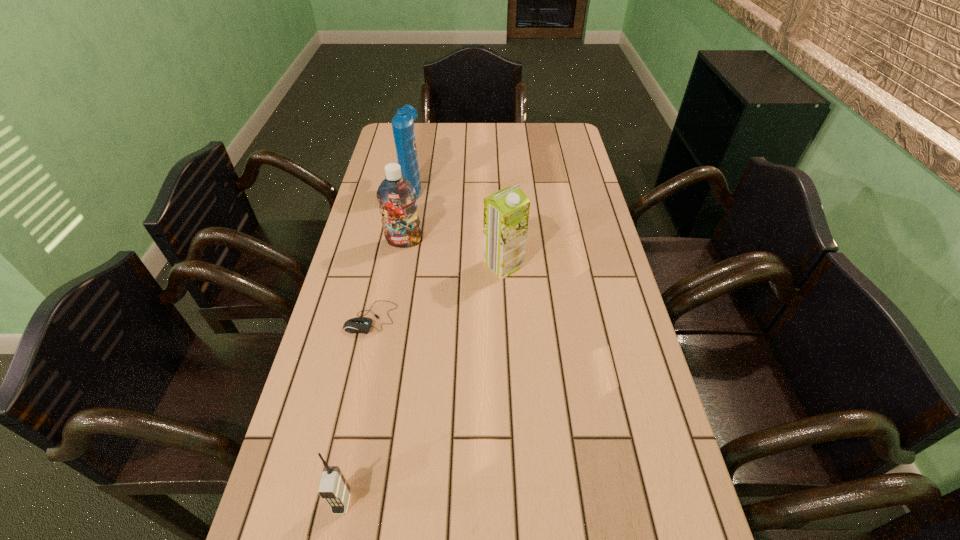
Find the location of a particular element. This screenshot has height=540, width=960. free space between the third farthest object and the farther shampoo is located at coordinates (458, 226).

The height and width of the screenshot is (540, 960). I want to click on free spot between the computer mouse and the farthest object, so click(x=392, y=252).

Locate an element on the screen. Image resolution: width=960 pixels, height=540 pixels. vacant area that lies between the third farthest object and the second shortest object is located at coordinates (422, 383).

The image size is (960, 540). I want to click on vacant space in between the cellular telephone and the farther shampoo, so click(x=377, y=345).

Locate an element on the screen. This screenshot has height=540, width=960. free spot between the nearest object and the nearer shampoo is located at coordinates (373, 372).

The height and width of the screenshot is (540, 960). I want to click on free space between the fourth nearest object and the cellular telephone, so click(x=373, y=372).

Locate an element on the screen. object that can be found as the second closest to the farthest object is located at coordinates (506, 212).

Locate which object ranks second in proximity to the farther shampoo. Please provide its 2D coordinates. Your answer should be formatted as a tuple, i.e. [(x, y)], where the tuple contains the x and y coordinates of a point satisfying the conditions above.

[(506, 212)]

Locate an element on the screen. blank area in the image that satisfies the following two spatial constraints: 1. on the front label of the third farthest object; 2. on the right side of the second farthest object is located at coordinates (399, 265).

Find the location of a particular element. Image resolution: width=960 pixels, height=540 pixels. free space that satisfies the following two spatial constraints: 1. on the front label of the fourth nearest object; 2. on the left side of the rightmost object is located at coordinates (399, 265).